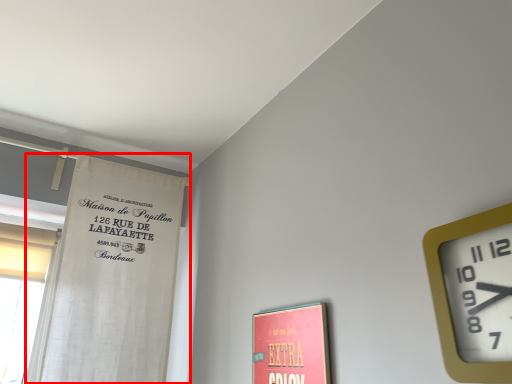
Question: In this image, where is curtain (annotated by the red box) located relative to wall clock?

Choices:
 (A) left
 (B) right

Answer: (A)